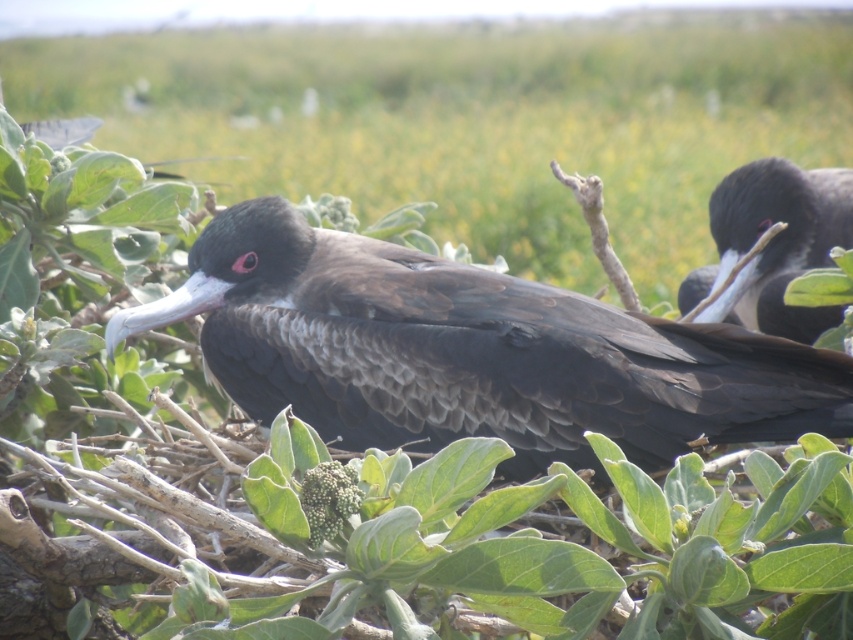
Question: Can you confirm if matte black bird at center is positioned to the left of shiny black bird at upper right?

Choices:
 (A) no
 (B) yes

Answer: (B)

Question: Does matte black bird at center come in front of shiny black bird at upper right?

Choices:
 (A) yes
 (B) no

Answer: (A)

Question: Is matte black bird at center positioned behind shiny black bird at upper right?

Choices:
 (A) no
 (B) yes

Answer: (A)

Question: Which of the following is the closest to the observer?

Choices:
 (A) shiny black bird at upper right
 (B) matte black bird at center

Answer: (B)

Question: Which point is farther from the camera taking this photo?

Choices:
 (A) (711, 208)
 (B) (350, 348)

Answer: (A)